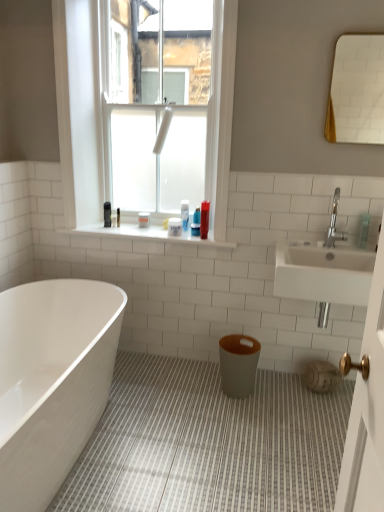
The image size is (384, 512). Find the location of `white glossy mirror at upper right`. white glossy mirror at upper right is located at coordinates coord(357,91).

The image size is (384, 512). What do you see at coordinates (357, 91) in the screenshot?
I see `white glossy mirror at upper right` at bounding box center [357, 91].

The height and width of the screenshot is (512, 384). I want to click on clear glass window at upper center, so click(x=83, y=120).

Measure the distance between matte gray toilet bowl at center and camera.

matte gray toilet bowl at center and camera are 7.19 feet apart.

Identify the location of white plastic container at upper center, the 3th toiletry from the front. (174, 226).

What is the approximate height of translucent plastic bottle at upper center, acting as the third toiletry starting from the left?

translucent plastic bottle at upper center, acting as the third toiletry starting from the left, is 16.97 centimeters tall.

Identify the location of white glossy mirror at upper right. The height and width of the screenshot is (512, 384). (357, 91).

Is matte gray toilet bowl at center at the back of clear glass window at upper center?

No, clear glass window at upper center is not facing the opposite direction of matte gray toilet bowl at center.

From a real-world perspective, is clear glass window at upper center physically located above or below matte gray toilet bowl at center?

From a real-world perspective, clear glass window at upper center is physically above matte gray toilet bowl at center.

Consider the image. Relative to matte gray toilet bowl at center, is clear glass window at upper center in front or behind?

Clearly, clear glass window at upper center is in front of matte gray toilet bowl at center.

Does clear glass window at upper center have a smaller size compared to matte gray toilet bowl at center?

No, clear glass window at upper center is not smaller than matte gray toilet bowl at center.

Is silver metallic faucet at upper right positioned far away from white tile at upper center?

No, there isn't a large distance between silver metallic faucet at upper right and white tile at upper center.

Between silver metallic faucet at upper right and white tile at upper center, which one has less height?

white tile at upper center.

Which is in front, point (346, 240) or point (69, 228)?

The point (346, 240) is closer.

Considering their positions, is silver metallic faucet at upper right located in front of or behind white tile at upper center?

silver metallic faucet at upper right is positioned closer to the viewer than white tile at upper center.

Can you confirm if white matte container at window, the fifth toiletry positioned from the front, is shorter than matte gray toilet bowl at center?

Yes, white matte container at window, the fifth toiletry positioned from the front, is shorter than matte gray toilet bowl at center.

Is point (140, 226) more distant than point (239, 367)?

Yes, it is.

Which object is positioned more to the left, white matte container at window, the fifth toiletry positioned from the front, or matte gray toilet bowl at center?

white matte container at window, the fifth toiletry positioned from the front.

Based on the photo, does white plastic container at upper center, arranged as the second toiletry when viewed from the left, turn towards white tile at upper center?

No.

At what (x,y) coordinates should I click in order to perform the action: click on window sill below the white plastic container at upper center, which is the third toiletry from back to front (from the image's perspective). Please return your answer as a coordinate pair (x, y). This screenshot has height=512, width=384. Looking at the image, I should click on (145, 234).

Between white plastic container at upper center, which is the third toiletry from back to front, and white tile at upper center, which one is positioned behind?

white plastic container at upper center, which is the third toiletry from back to front, is further away from the camera.

Considering the relative sizes of white tile at upper center and clear plastic bottle at upper right, the fifth toiletry in the back-to-front sequence, in the image provided, is white tile at upper center taller than clear plastic bottle at upper right, the fifth toiletry in the back-to-front sequence,?

No, white tile at upper center is not taller than clear plastic bottle at upper right, the fifth toiletry in the back-to-front sequence.

Is white tile at upper center spatially inside clear plastic bottle at upper right, which is counted as the first toiletry, starting from the right, or outside of it?

white tile at upper center is not enclosed by clear plastic bottle at upper right, which is counted as the first toiletry, starting from the right.

Considering the sizes of objects white tile at upper center and clear plastic bottle at upper right, which is counted as the first toiletry, starting from the right, in the image provided, who is wider, white tile at upper center or clear plastic bottle at upper right, which is counted as the first toiletry, starting from the right,?

white tile at upper center.

How different are the orientations of white tile at upper center and clear plastic bottle at upper right, which is counted as the first toiletry, starting from the right, in degrees?

They differ by 0.475 degrees in their facing directions.

Which is less distant, (145, 227) or (196, 225)?

The point (196, 225) is in front.

From the image's perspective, is white matte container at window, which is the 5th toiletry from right to left, positioned above or below translucent plastic bottle at upper center, which appears as the 3th toiletry when viewed from the right?

white matte container at window, which is the 5th toiletry from right to left, is below translucent plastic bottle at upper center, which appears as the 3th toiletry when viewed from the right.

Measure the distance between white matte container at window, which is the 5th toiletry from right to left, and translucent plastic bottle at upper center, acting as the third toiletry starting from the left.

35.35 centimeters.

Is white matte container at window, which is the first toiletry in left-to-right order, thinner than translucent plastic bottle at upper center, acting as the third toiletry starting from the left?

No.

Is the depth of clear glass window at upper center greater than that of white matte container at window, which appears as the first toiletry when viewed from the back?

No, it is in front of white matte container at window, which appears as the first toiletry when viewed from the back.

Is clear glass window at upper center in contact with white matte container at window, the fifth toiletry positioned from the front?

No, clear glass window at upper center is not making contact with white matte container at window, the fifth toiletry positioned from the front.

Considering the relative sizes of clear glass window at upper center and white matte container at window, which appears as the first toiletry when viewed from the back, in the image provided, is clear glass window at upper center taller than white matte container at window, which appears as the first toiletry when viewed from the back,?

Yes.

Considering the positions of objects clear glass window at upper center and white matte container at window, which appears as the first toiletry when viewed from the back, in the image provided, who is more to the right, clear glass window at upper center or white matte container at window, which appears as the first toiletry when viewed from the back,?

Positioned to the right is clear glass window at upper center.

This screenshot has width=384, height=512. I want to click on toilet bowl located on the right of clear glass window at upper center, so click(238, 364).

The width and height of the screenshot is (384, 512). I want to click on window sill behind the silver metallic faucet at upper right, so click(x=145, y=234).

From the image, which object appears to be farther from matte gray toilet bowl at center, white glossy mirror at upper right or white matte container at window, the fifth toiletry positioned from the front?

white glossy mirror at upper right lies further to matte gray toilet bowl at center than the other object.

Based on their spatial positions, is white tile at upper center or white matte container at window, which appears as the first toiletry when viewed from the back, further from clear plastic bottle at upper right, positioned as the fifth toiletry in left-to-right order?

The object further to clear plastic bottle at upper right, positioned as the fifth toiletry in left-to-right order, is white matte container at window, which appears as the first toiletry when viewed from the back.

When comparing their distances from matte gray vase at lower right, does white plastic container at upper center, arranged as the second toiletry when viewed from the left, or white matte container at window, the fifth toiletry positioned from the front, seem further?

Among the two, white matte container at window, the fifth toiletry positioned from the front, is located further to matte gray vase at lower right.

From the image, which object appears to be nearer to clear plastic bottle at upper right, which is counted as the first toiletry, starting from the right, clear glass window at upper center or white plastic container at upper center, the 3th toiletry from the front?

white plastic container at upper center, the 3th toiletry from the front.

Estimate the real-world distances between objects in this image. Which object is closer to silver metallic faucet at upper right, white glossy bathtub at lower left or matte gray toilet bowl at center?

matte gray toilet bowl at center is positioned closer to the anchor silver metallic faucet at upper right.

From the image, which object appears to be nearer to clear plastic bottle at upper right, the fifth toiletry in the back-to-front sequence, translucent plastic bottle at upper center, placed as the fourth toiletry when sorted from front to back, or silver metallic faucet at upper right?

Based on the image, silver metallic faucet at upper right appears to be nearer to clear plastic bottle at upper right, the fifth toiletry in the back-to-front sequence.

Estimate the real-world distances between objects in this image. Which object is further from clear glass window at upper center, silver metallic faucet at upper right or white tile at upper center?

silver metallic faucet at upper right.

From the image, which object appears to be farther from silver metallic faucet at upper right, clear glass window at upper center or white tile at upper center?

clear glass window at upper center is further to silver metallic faucet at upper right.

Locate an element on the screen. The width and height of the screenshot is (384, 512). window sill between clear glass window at upper center and matte gray toilet bowl at center in the up-down direction is located at coordinates (145, 234).

Where is `window sill between white glossy bathtub at lower left and white glossy mirror at upper right from left to right`? This screenshot has width=384, height=512. window sill between white glossy bathtub at lower left and white glossy mirror at upper right from left to right is located at coordinates click(145, 234).

Locate an element on the screen. The width and height of the screenshot is (384, 512). tap situated between translucent plastic bottle at upper center, which appears as the 3th toiletry when viewed from the right, and clear plastic bottle at upper right, the 1th toiletry in the front-to-back sequence, from left to right is located at coordinates (334, 224).

Identify the location of toiletry between translucent plastic bottle at upper center, which appears as the 3th toiletry when viewed from the right, and clear plastic bottle at upper right, the fifth toiletry in the back-to-front sequence. (204, 219).